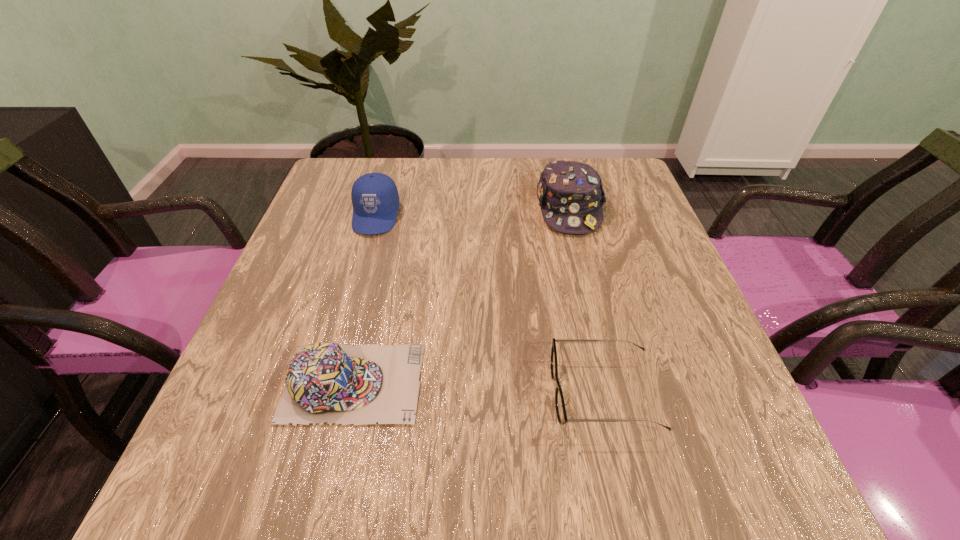
Image resolution: width=960 pixels, height=540 pixels. Find the location of `the rightmost cap`. the rightmost cap is located at coordinates (570, 194).

Where is `the nearest cap`? The image size is (960, 540). the nearest cap is located at coordinates (362, 384).

Find the location of a particular element. The image size is (960, 540). the second shortest object is located at coordinates (362, 384).

Where is `spectacles`? This screenshot has height=540, width=960. spectacles is located at coordinates (561, 413).

Where is `vacant space located on the front-facing side of the rightmost cap`? vacant space located on the front-facing side of the rightmost cap is located at coordinates (596, 319).

Locate an element on the screen. The image size is (960, 540). vacant space located on the front, side, and top of the shortest cap is located at coordinates (500, 383).

Find the location of a particular element. This screenshot has height=540, width=960. vacant space located through the lenses of the shortest object is located at coordinates (523, 393).

The width and height of the screenshot is (960, 540). I want to click on free spot located through the lenses of the shortest object, so click(425, 393).

At what (x,y) coordinates should I click in order to perform the action: click on free location located through the lenses of the shortest object. Please return your answer as a coordinate pair (x, y). Image resolution: width=960 pixels, height=540 pixels. Looking at the image, I should click on (367, 393).

This screenshot has width=960, height=540. Find the location of `headwear located in the right edge section of the desktop`. headwear located in the right edge section of the desktop is located at coordinates (570, 194).